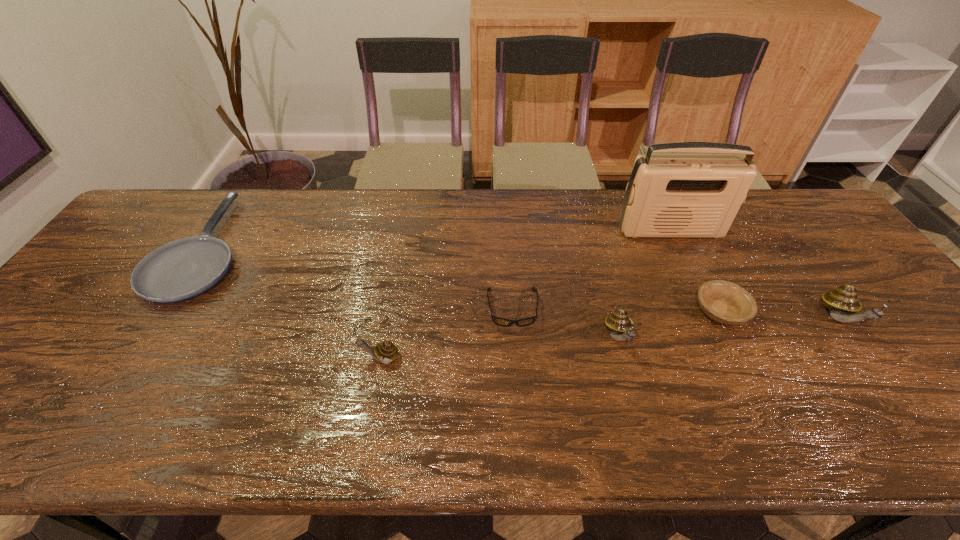
This screenshot has width=960, height=540. What are the coordinates of `vacant spot to place a snail on the left` in the screenshot? It's located at (123, 380).